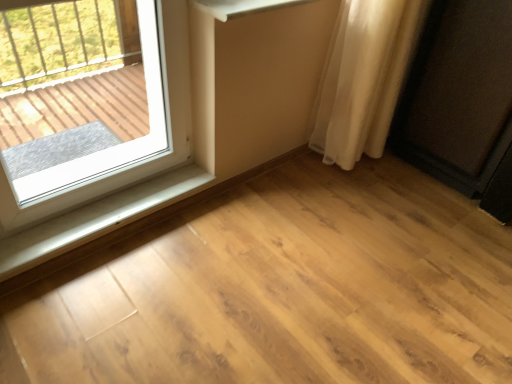
Question: In the image, is white plastic window at upper left on the left side or the right side of white plastic window sill at lower left?

Choices:
 (A) left
 (B) right

Answer: (B)

Question: From a real-world perspective, relative to white plastic window sill at lower left, is white plastic window at upper left vertically above or below?

Choices:
 (A) above
 (B) below

Answer: (A)

Question: Based on their relative distances, which object is farther from the matte black speaker at right?

Choices:
 (A) white sheer curtain at right
 (B) white plastic window sill at lower left
 (C) white plastic window at upper left

Answer: (C)

Question: Estimate the real-world distances between objects in this image. Which object is closer to the white sheer curtain at right?

Choices:
 (A) matte black speaker at right
 (B) white plastic window sill at lower left
 (C) white plastic window at upper left

Answer: (A)